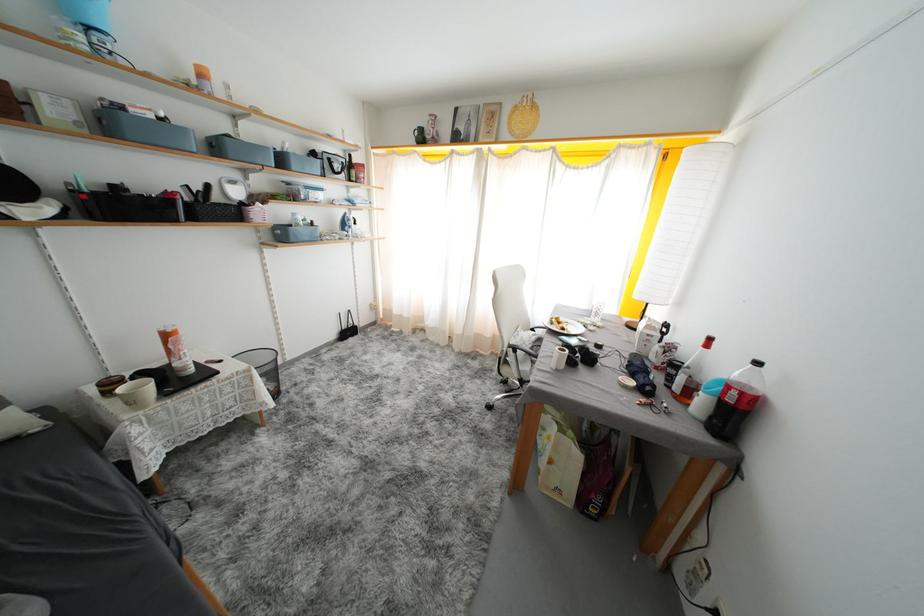
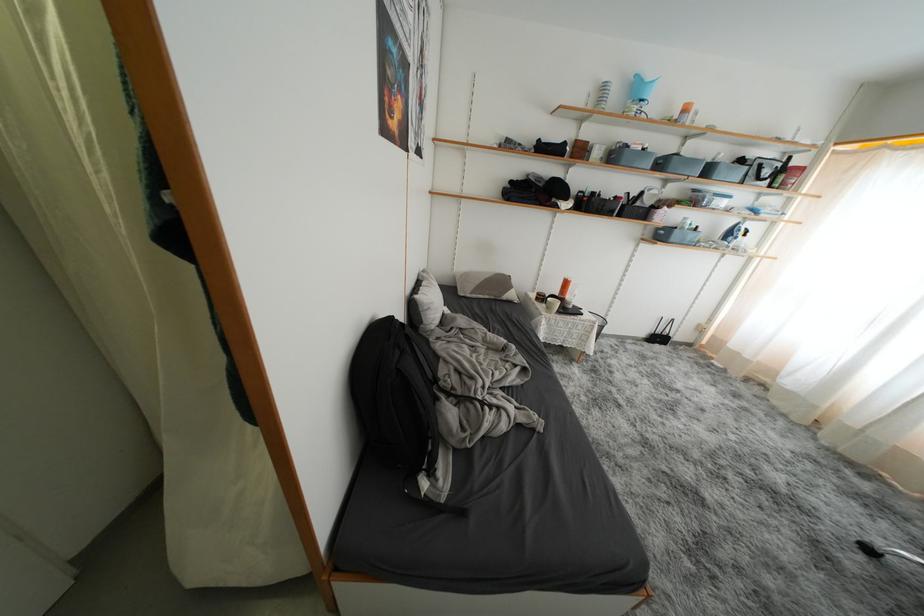
In the second image, find the point that corresponds to the point at 288,164 in the first image.

(714, 175)